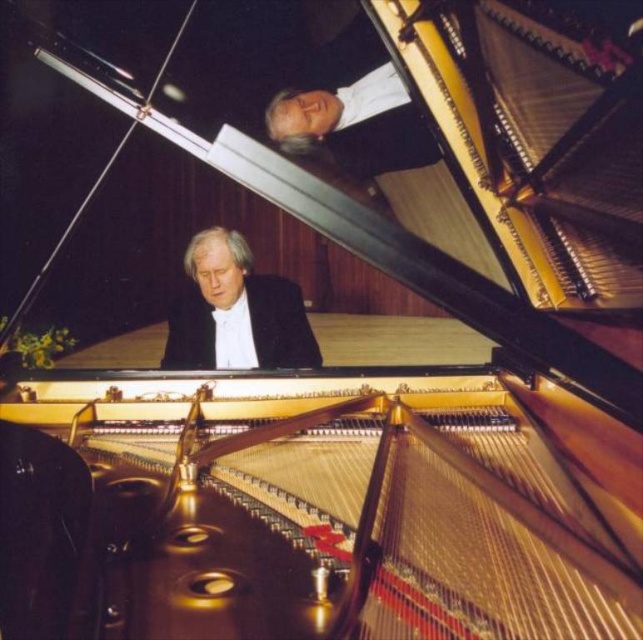
You are a technician working on the piano and need to locate the matte black suit at center. Where exactly is it positioned in the image?

The matte black suit at center is positioned at point coordinates of 0.489 on the x axis and 0.369 on the y axis.

Based on the photo, you are a photographer taking a portrait of the musician inside the grand piano. You need to ensure that both the matte black suit at center and the white silk shirt at upper center are clearly visible in the frame. Given their heights, which one might require more careful positioning to avoid being obscured by the piano strings?

The matte black suit at center is taller than the white silk shirt at upper center, so the matte black suit at center might be more likely to be obscured by the piano strings and requires careful positioning to ensure visibility.

You are a photographer inside the grand piano and want to take a photo of the musician. The camera is positioned so that the view is from the open lid towards the keyboard. Which object, the matte black suit at center or the white silk shirt at upper center, will appear closer to the left side of the photo?

The matte black suit at center will appear closer to the left side of the photo because it is positioned to the left of the white silk shirt at upper center.